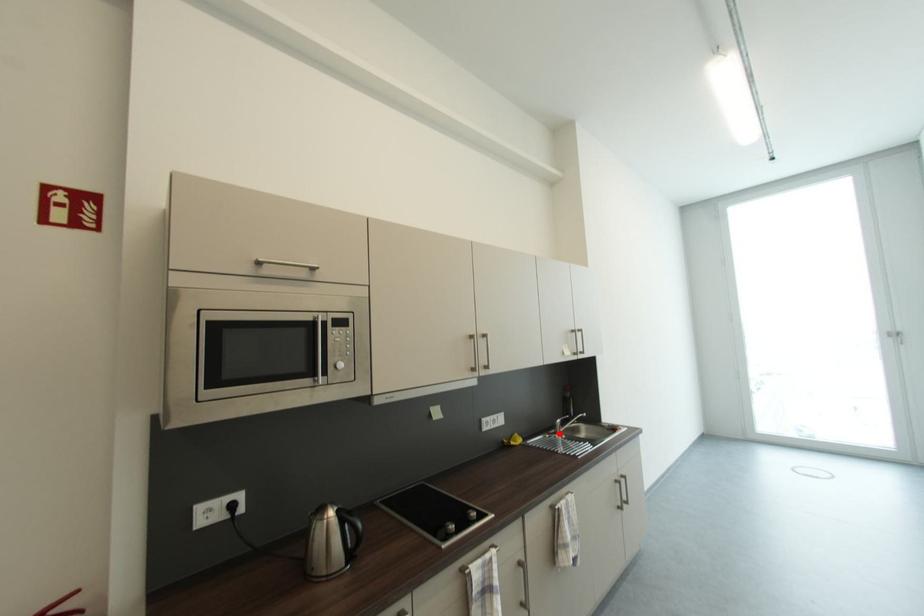
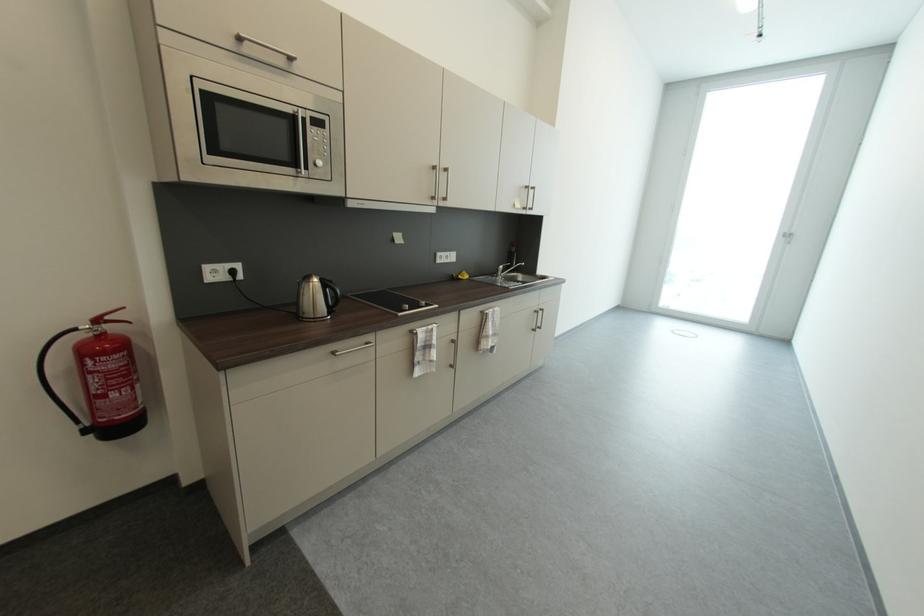
Locate, in the second image, the point that corresponds to the highlighted location in the first image.

(502, 277)